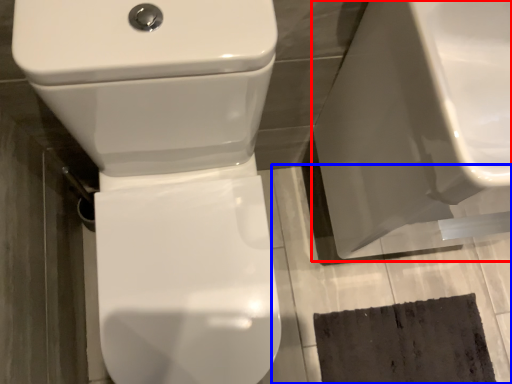
Question: Which point is closer to the camera, porcelain (highlighted by a red box) or concrete (highlighted by a blue box)?

Choices:
 (A) porcelain
 (B) concrete

Answer: (A)